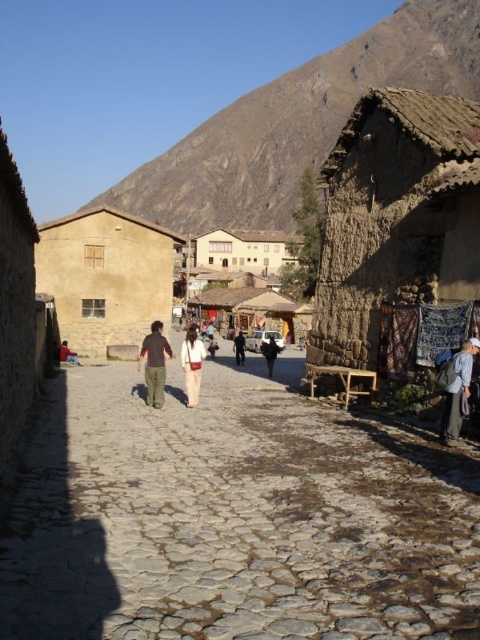
You are standing on the cobblestone street and want to enter the beige stucco hut at center and the beige stone house at center. Which building will you reach first if you walk straight ahead?

You will reach the beige stucco hut at center first because it is closer to you than the beige stone house at center.

You are standing on the cobblestone street in the village and want to take a photo. There are two points marked in the scene. The first point is at coordinate point [56,566] and the second is at point [240,356]. If you want to focus on the closer point to ensure it is sharp in your photo, which coordinate should you focus on?

Point [56,566] is closer to the camera than point [240,356], so you should focus on point [56,566] to ensure it is sharp in your photo.

You are a traveler standing on the cobblestone street and want to find the smaller building between the beige stucco hut at center and the beige stone house at center. Which one should you look for?

The beige stucco hut at center is smaller compared to the beige stone house at center, so you should look for the beige stucco hut at center.